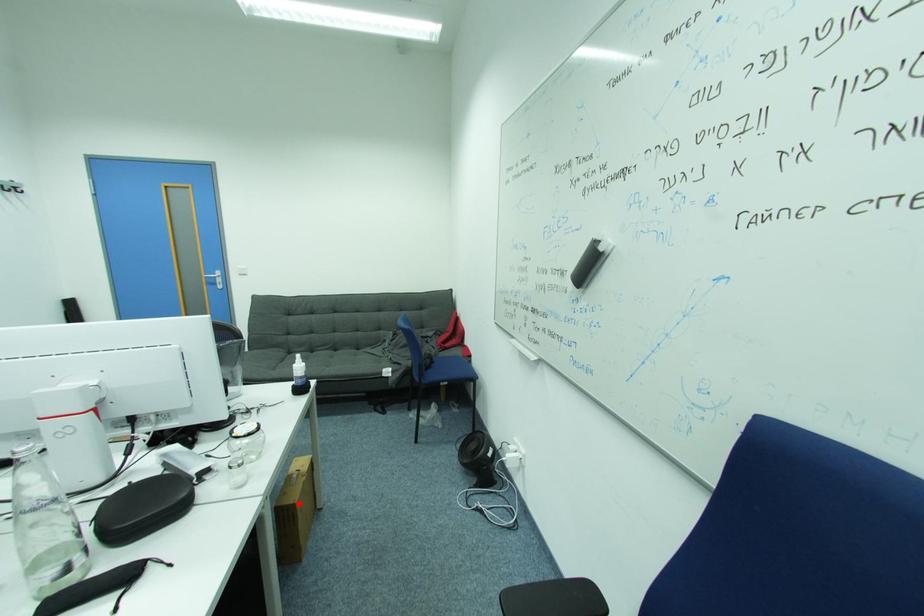
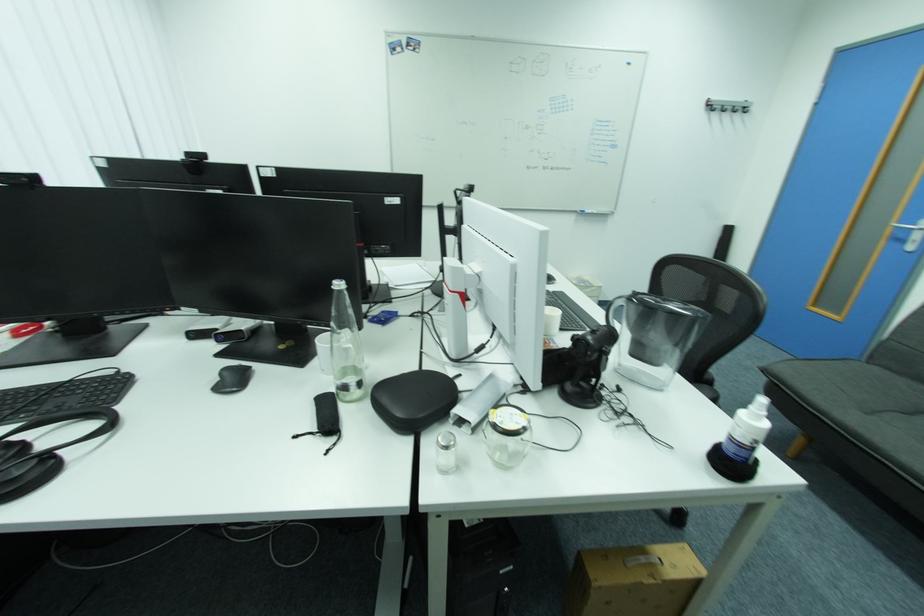
Where in the second image is the point corresponding to the highlighted location from the first image?

(597, 576)